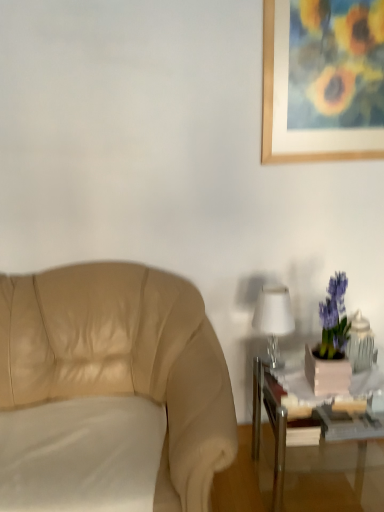
Question: Does white glossy table lamp at right have a greater width compared to beige leather chair at left?

Choices:
 (A) no
 (B) yes

Answer: (A)

Question: From a real-world perspective, is white glossy table lamp at right physically below beige leather chair at left?

Choices:
 (A) no
 (B) yes

Answer: (A)

Question: Is white glossy table lamp at right completely or partially outside of beige leather chair at left?

Choices:
 (A) yes
 (B) no

Answer: (A)

Question: Is white glossy table lamp at right not close to beige leather chair at left?

Choices:
 (A) no
 (B) yes

Answer: (A)

Question: Is white glossy table lamp at right further to camera compared to beige leather chair at left?

Choices:
 (A) yes
 (B) no

Answer: (A)

Question: From the image's perspective, is white glossy table lamp at right above or below metallic silver table at lower right?

Choices:
 (A) below
 (B) above

Answer: (B)

Question: Does point (278, 300) appear closer or farther from the camera than point (337, 418)?

Choices:
 (A) closer
 (B) farther

Answer: (A)

Question: Would you say white glossy table lamp at right is inside or outside metallic silver table at lower right?

Choices:
 (A) outside
 (B) inside

Answer: (A)

Question: Relative to metallic silver table at lower right, is white glossy table lamp at right in front or behind?

Choices:
 (A) front
 (B) behind

Answer: (B)

Question: From the image's perspective, is white fabric pillow at lower left positioned above or below metallic silver table at lower right?

Choices:
 (A) below
 (B) above

Answer: (A)

Question: Is white fabric pillow at lower left wider or thinner than metallic silver table at lower right?

Choices:
 (A) thin
 (B) wide

Answer: (B)

Question: Visually, is white fabric pillow at lower left positioned to the left or to the right of metallic silver table at lower right?

Choices:
 (A) left
 (B) right

Answer: (A)

Question: Relative to metallic silver table at lower right, is white fabric pillow at lower left in front or behind?

Choices:
 (A) behind
 (B) front

Answer: (B)

Question: Is metallic silver table at lower right spatially inside beige leather chair at left, or outside of it?

Choices:
 (A) inside
 (B) outside

Answer: (B)

Question: Based on their sizes in the image, would you say metallic silver table at lower right is bigger or smaller than beige leather chair at left?

Choices:
 (A) big
 (B) small

Answer: (B)